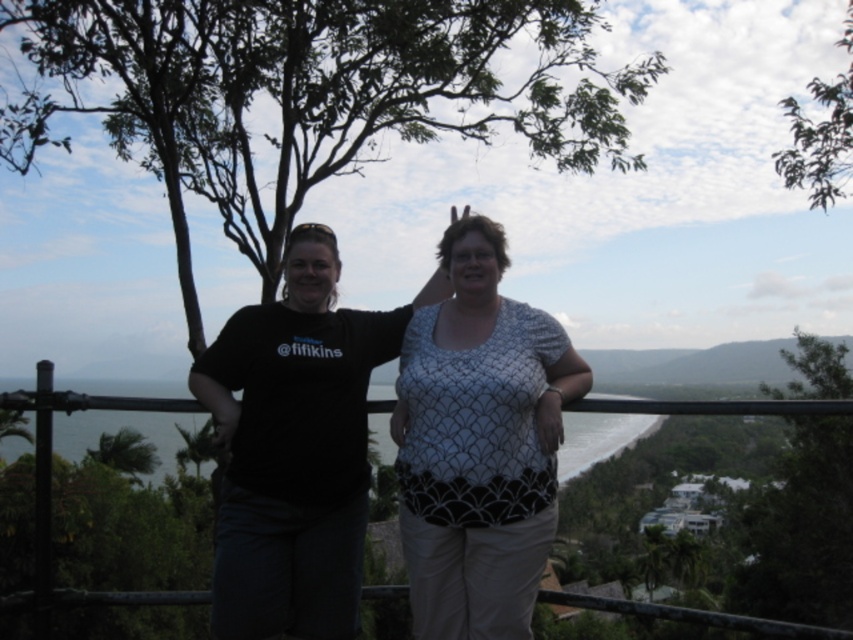
You are a photographer trying to capture a clear shot of the white textured blouse at center and the green leafy tree at right. Which object is closer to the camera?

The white textured blouse at center is closer to the camera than the green leafy tree at right because it is further to the viewer according to the description.

You are a photographer trying to capture the white textured blouse at center and the green leafy tree at right in a single frame. Which object should you focus on first if you want to ensure both are visible without moving the camera?

You should focus on the green leafy tree at right first because it occupies more space in the frame than the white textured blouse at center, ensuring it stays in focus while the smaller blouse remains visible.

You are a photographer trying to frame a shot of the two people in the scene. Since you want to balance the composition using the green leafy tree at upper left and the green leafy tree at upper right, which tree should you place closer to the center of the frame?

To balance the composition, you should place the larger green leafy tree at upper right closer to the center of the frame because it is bigger than the green leafy tree at upper left.